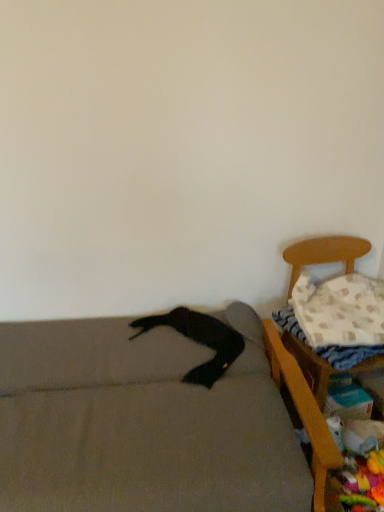
The width and height of the screenshot is (384, 512). I want to click on vacant space situated above white textured blanket at right (from a real-world perspective), so click(x=348, y=321).